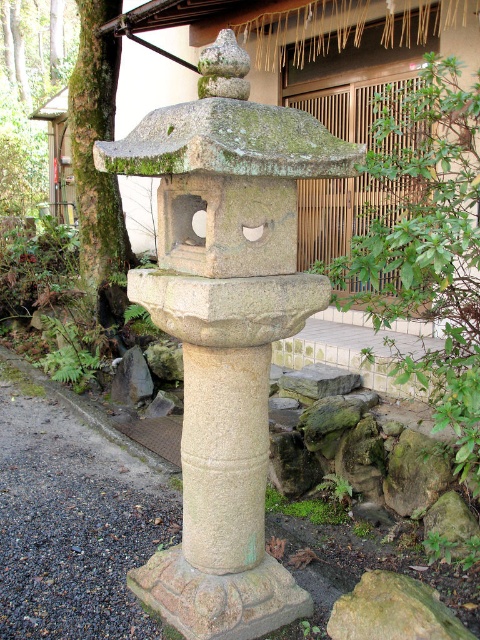
Does green stone lantern at center appear on the left side of green mossy bark at left?

Incorrect, green stone lantern at center is not on the left side of green mossy bark at left.

Which is below, green stone lantern at center or green mossy bark at left?

green stone lantern at center is below.

Between point (241, 566) and point (72, 86), which one is positioned behind?

Positioned behind is point (72, 86).

The height and width of the screenshot is (640, 480). Find the location of `green stone lantern at center`. green stone lantern at center is located at coordinates (226, 326).